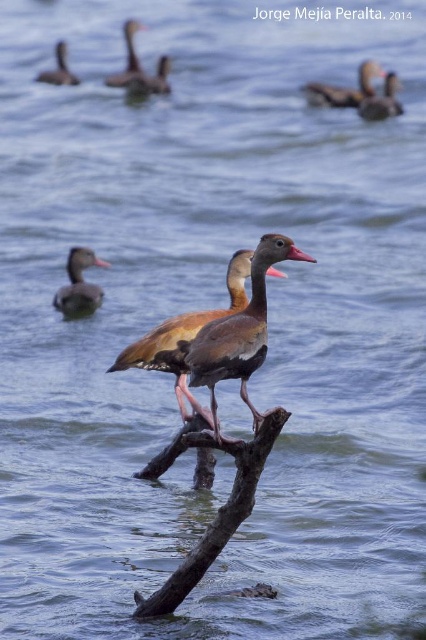
You are a small frog trying to jump from the brown wood at center to the brown matte duck at upper center. Based on the scene, can you reach the duck in one jump?

The brown wood at center is wider than brown matte duck at upper center, so the frog can jump from the brown wood at center to the brown matte duck at upper center in one jump.

You are a photographer aiming to capture the duck on the branch in the foreground. You notice two points marked on your camera screen at coordinates point [244,266] and point [149,83]. Which point should you focus on to ensure the duck on the branch is sharp in the photo?

You should focus on point [244,266] because it is in front of point [149,83] and closer to the duck on the branch.

You are a wildlife photographer aiming to capture a closeup shot of the duck at the center. You notice a point marked at coordinates (184, 337) in the scene. Based on the description, is this point likely located on the matte brown duck at center?

Yes, the point at coordinates (184, 337) corresponds to the matte brown duck at center, so it is likely located on the duck.